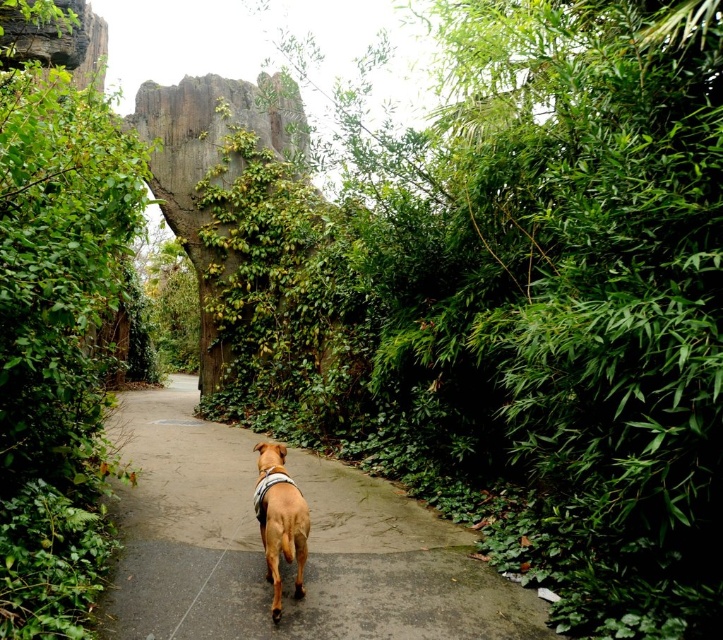
Between green leafy foliage at center and green leafy bush at left, which one is positioned lower?

green leafy bush at left is lower down.

Is point (442, 384) more distant than point (7, 164)?

Yes, point (442, 384) is farther from viewer.

Does point (429, 355) come farther from viewer compared to point (46, 291)?

That is True.

Locate an element on the screen. This screenshot has width=723, height=640. green leafy foliage at center is located at coordinates (513, 304).

Who is lower down, green leafy foliage at center or brown concrete path at center?

Positioned lower is brown concrete path at center.

Can you confirm if green leafy foliage at center is taller than brown concrete path at center?

Yes, green leafy foliage at center is taller than brown concrete path at center.

What do you see at coordinates (513, 304) in the screenshot? The image size is (723, 640). I see `green leafy foliage at center` at bounding box center [513, 304].

Locate an element on the screen. The height and width of the screenshot is (640, 723). green leafy foliage at center is located at coordinates (513, 304).

Can you confirm if green mossy rock at center is shorter than brown matte dog at center?

No.

Does green mossy rock at center have a greater height compared to brown matte dog at center?

Correct, green mossy rock at center is much taller as brown matte dog at center.

Between point (231, 269) and point (270, 563), which one is positioned behind?

Positioned behind is point (231, 269).

Image resolution: width=723 pixels, height=640 pixels. What are the coordinates of `green mossy rock at center` in the screenshot? It's located at (210, 164).